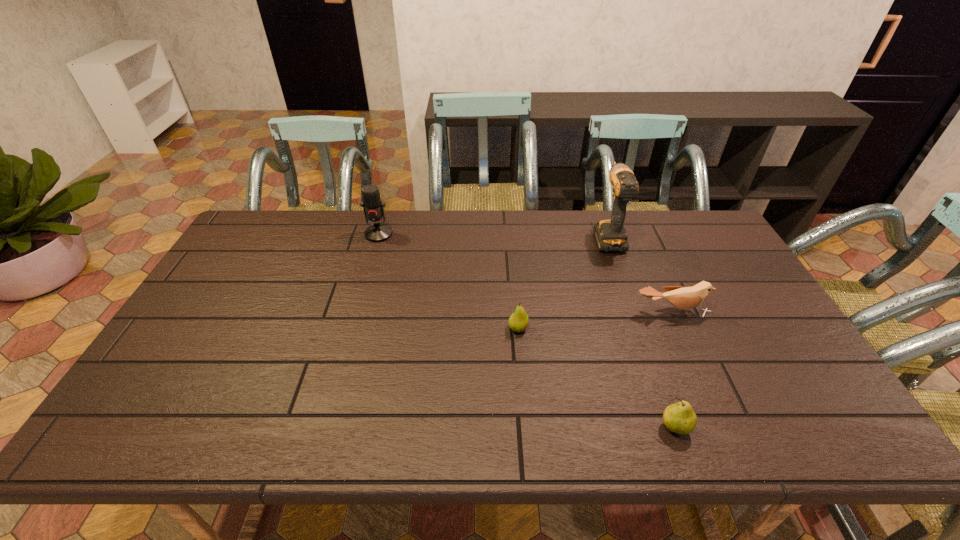
Image resolution: width=960 pixels, height=540 pixels. In order to click on free space at the far right corner of the desktop in this screenshot , I will do `click(704, 215)`.

Identify the location of unoccupied area between the drill and the nearer pear. This screenshot has height=540, width=960. (641, 332).

The height and width of the screenshot is (540, 960). Find the location of `unoccupied position between the bird and the fourth farthest object`. unoccupied position between the bird and the fourth farthest object is located at coordinates (595, 320).

The image size is (960, 540). What are the coordinates of `free spot between the tallest object and the nearest object` in the screenshot? It's located at (641, 332).

You are a GUI agent. You are given a task and a screenshot of the screen. Output one action in this format:
    pyautogui.click(x=<x>, y=<y>)
    Task: Click on the unoccupied position between the bird and the leftmost object
    The width and height of the screenshot is (960, 540).
    Given the screenshot: What is the action you would take?
    pyautogui.click(x=525, y=273)

Find the location of `empty location between the microphone and the nearer pear`. empty location between the microphone and the nearer pear is located at coordinates (527, 331).

Identify the location of free space between the microphone and the right pear. coord(527,331).

You are a GUI agent. You are given a task and a screenshot of the screen. Output one action in this format:
    pyautogui.click(x=<x>, y=<y>)
    Task: Click on the blank region between the third farthest object and the tallest object
    The width and height of the screenshot is (960, 540).
    Given the screenshot: What is the action you would take?
    pyautogui.click(x=639, y=274)

I want to click on free space that is in between the left pear and the microphone, so click(x=448, y=281).

I want to click on vacant area that lies between the tallest object and the bird, so click(639, 274).